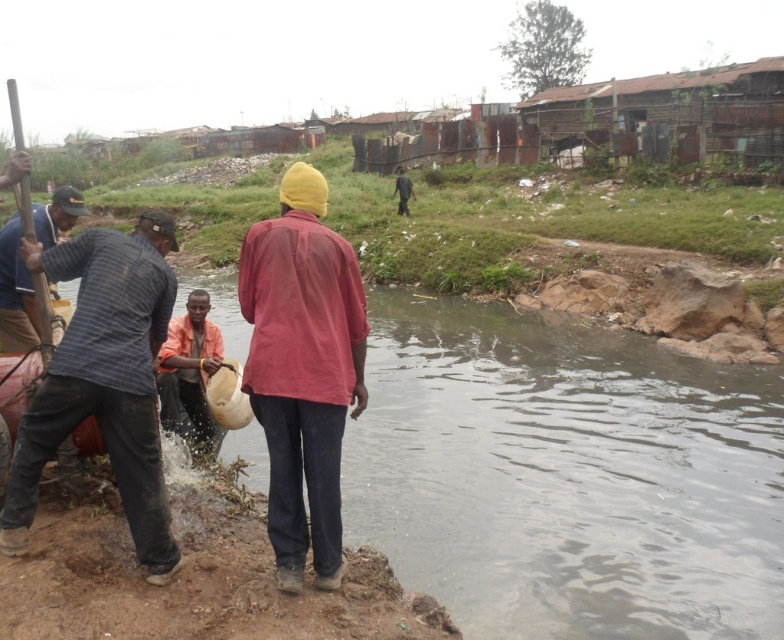
You are a photographer trying to capture a detailed shot of both the striped cotton shirt at left and the orange fabric bag at lower left. Given their sizes, which object should you focus on first to ensure it fits entirely in your camera frame?

The striped cotton shirt at left is bigger than the orange fabric bag at lower left, so you should focus on capturing the striped cotton shirt at left first to ensure its entire size fits in the frame before adjusting for the smaller orange fabric bag at lower left.

You are a photographer trying to capture the striped cotton shirt at left and the striped fabric shirt at left in the same frame. Which shirt should you focus on first to ensure both are in the frame?

You should focus on the striped cotton shirt at left first because it is positioned under the striped fabric shirt at left, so capturing it first ensures both are in the frame.